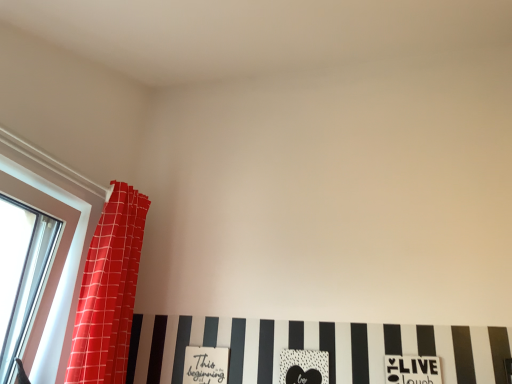
Question: Could you tell me if clear glass window at left is turned towards white matte print at lower center, the third print from the left?

Choices:
 (A) yes
 (B) no

Answer: (A)

Question: Is clear glass window at left positioned beyond the bounds of white matte print at lower center, the 1th print in the right-to-left sequence?

Choices:
 (A) no
 (B) yes

Answer: (B)

Question: Does clear glass window at left come in front of white matte print at lower center, the third print from the left?

Choices:
 (A) yes
 (B) no

Answer: (A)

Question: Is clear glass window at left oriented away from white matte print at lower center, the 1th print in the right-to-left sequence?

Choices:
 (A) no
 (B) yes

Answer: (A)

Question: Does clear glass window at left have a greater height compared to white matte print at lower center, the 1th print in the right-to-left sequence?

Choices:
 (A) yes
 (B) no

Answer: (A)

Question: From the image's perspective, is clear glass window at left beneath white matte print at lower center, the 1th print in the right-to-left sequence?

Choices:
 (A) no
 (B) yes

Answer: (A)

Question: Is black matte heart at center, placed as the second print when sorted from right to left, completely or partially inside matte white sign at lower center, which is the 1th print in left-to-right order?

Choices:
 (A) no
 (B) yes

Answer: (A)

Question: Is the depth of matte white sign at lower center, which is the 1th print in left-to-right order, greater than that of black matte heart at center, placed as the second print when sorted from left to right?

Choices:
 (A) no
 (B) yes

Answer: (B)

Question: From the image's perspective, is matte white sign at lower center, which is the third print from right to left, on top of black matte heart at center, placed as the second print when sorted from right to left?

Choices:
 (A) no
 (B) yes

Answer: (A)

Question: Does matte white sign at lower center, which is the 1th print in left-to-right order, turn towards black matte heart at center, placed as the second print when sorted from right to left?

Choices:
 (A) yes
 (B) no

Answer: (B)

Question: Is matte white sign at lower center, which is the third print from right to left, to the right of black matte heart at center, placed as the second print when sorted from right to left, from the viewer's perspective?

Choices:
 (A) no
 (B) yes

Answer: (A)

Question: Does matte white sign at lower center, which is the 1th print in left-to-right order, have a greater width compared to black matte heart at center, placed as the second print when sorted from right to left?

Choices:
 (A) no
 (B) yes

Answer: (A)

Question: Can you confirm if black matte heart at center, placed as the second print when sorted from left to right, is wider than matte white sign at lower center, which is the third print from right to left?

Choices:
 (A) yes
 (B) no

Answer: (A)